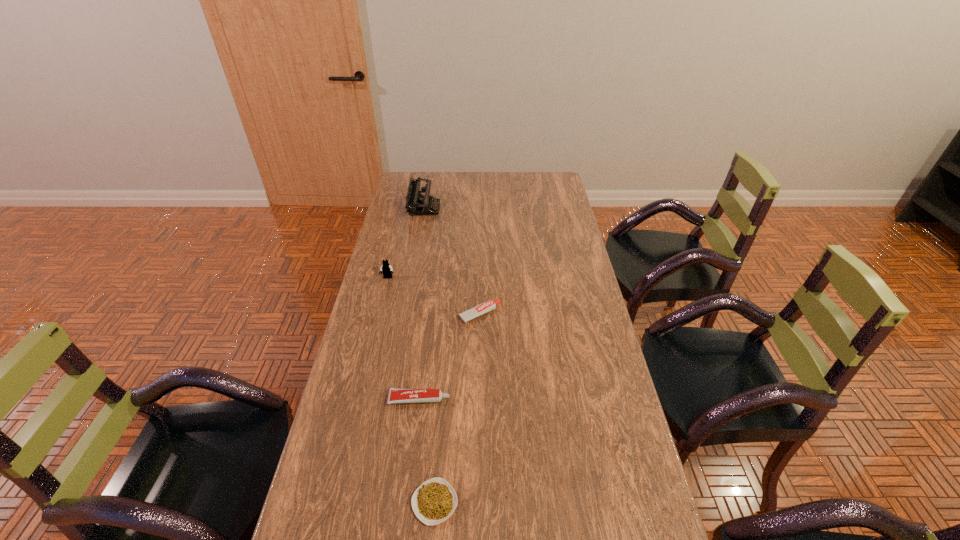
Where is `typewriter`? The width and height of the screenshot is (960, 540). typewriter is located at coordinates (423, 205).

You are a GUI agent. You are given a task and a screenshot of the screen. Output one action in this format:
    pyautogui.click(x=<x>, y=<y>)
    Task: Click on the farthest object
    The image size is (960, 540).
    Given the screenshot: What is the action you would take?
    pyautogui.click(x=423, y=205)

This screenshot has height=540, width=960. I want to click on the second tallest object, so click(386, 268).

Image resolution: width=960 pixels, height=540 pixels. Find the location of `Lego`. Lego is located at coordinates (386, 268).

Where is `the left toothpaste`? the left toothpaste is located at coordinates (396, 395).

Identify the location of the fourth farthest object. The height and width of the screenshot is (540, 960). (396, 395).

Locate an element on the screen. This screenshot has height=540, width=960. the third farthest object is located at coordinates (489, 305).

Identify the location of the farther toothpaste. The image size is (960, 540). (489, 305).

This screenshot has width=960, height=540. What are the coordinates of `legume` in the screenshot? It's located at click(x=434, y=501).

I want to click on the nearest object, so click(x=434, y=501).